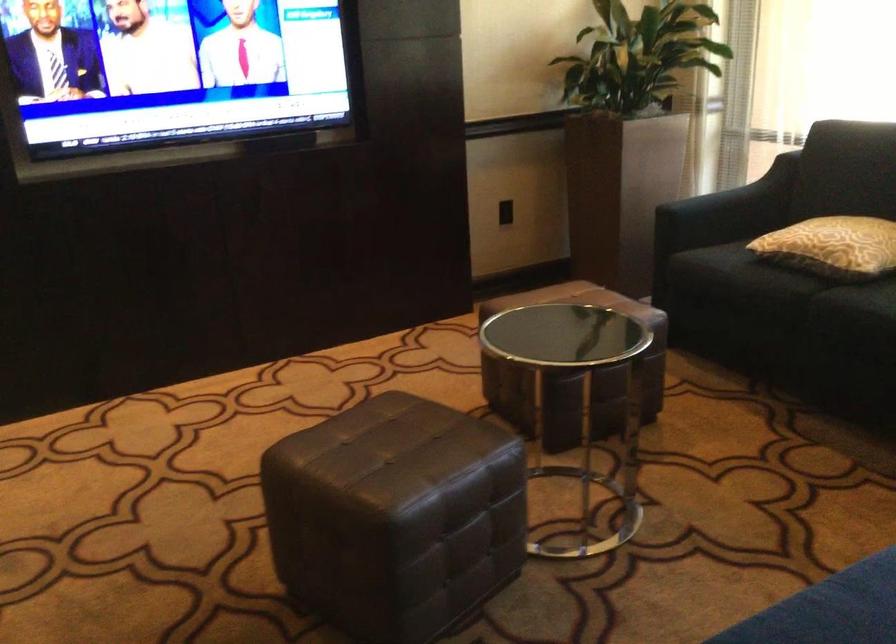
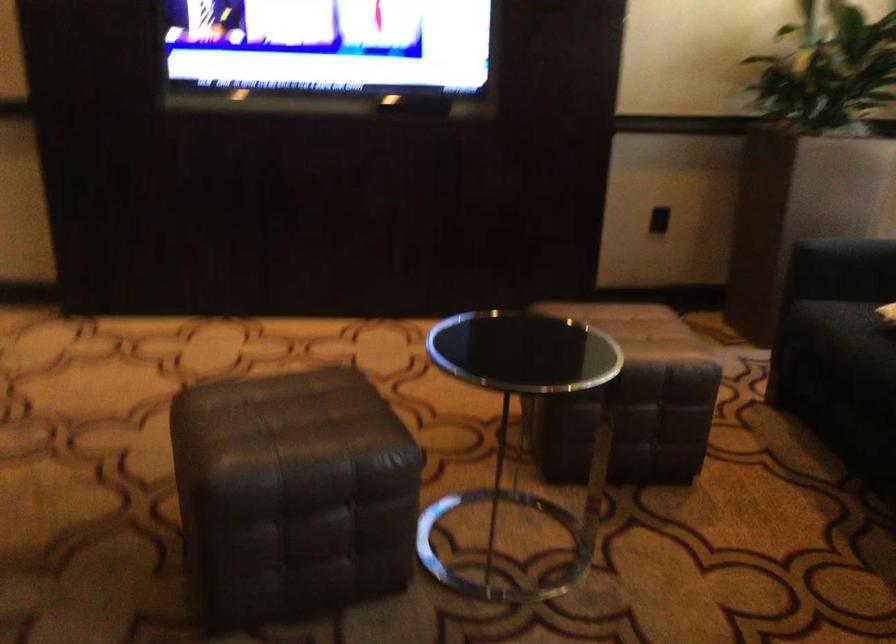
Which direction would the cameraman need to move to produce the second image?

The movement direction of the cameraman is right, forward.